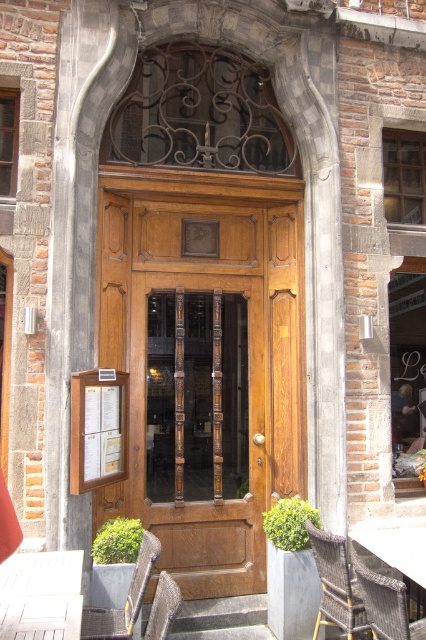
Question: Which of the following is the closest to the observer?

Choices:
 (A) (146, 568)
 (B) (388, 616)
 (C) (339, 588)

Answer: (B)

Question: Is wooden door at center positioned before rattan chair at lower right?

Choices:
 (A) yes
 (B) no

Answer: (B)

Question: Where is rattan chair at lower right located in relation to wooden textured chair at lower left in the image?

Choices:
 (A) below
 (B) above

Answer: (A)

Question: Does rattan chair at lower right appear over metallic woven chair at lower center?

Choices:
 (A) yes
 (B) no

Answer: (B)

Question: Which of the following is the closest to the observer?

Choices:
 (A) metallic woven chair at lower center
 (B) metallic woven chair at lower right

Answer: (A)

Question: Which of the following is the farthest from the observer?

Choices:
 (A) wooden table at lower left
 (B) rattan chair at lower right

Answer: (B)